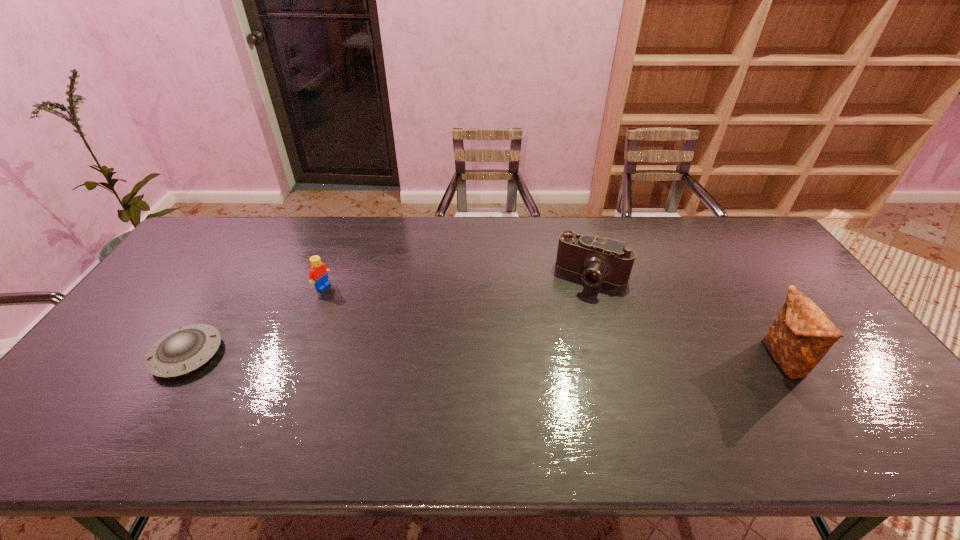
Locate an element on the screen. The width and height of the screenshot is (960, 540). free spot located 0.120m on the front-facing side of the second object from right to left is located at coordinates (568, 319).

The width and height of the screenshot is (960, 540). I want to click on vacant area located on the front-facing side of the second object from right to left, so click(562, 333).

The width and height of the screenshot is (960, 540). Find the location of `free location located 0.390m on the front-facing side of the second object from right to left`. free location located 0.390m on the front-facing side of the second object from right to left is located at coordinates (533, 391).

Where is `blank space located on the face of the Lego`? blank space located on the face of the Lego is located at coordinates (394, 324).

Find the location of a particular element. vacant space located 0.190m on the face of the Lego is located at coordinates 374,314.

Find the location of a particular element. vacant space located on the face of the Lego is located at coordinates (424, 340).

This screenshot has width=960, height=540. I want to click on saucer that is at the near edge, so click(185, 349).

Locate an element on the screen. Image resolution: width=960 pixels, height=540 pixels. clutch bag located at the near edge is located at coordinates (802, 334).

At what (x,y) coordinates should I click in order to perform the action: click on object that is positioned at the left edge. Please return your answer as a coordinate pair (x, y). Image resolution: width=960 pixels, height=540 pixels. Looking at the image, I should click on (185, 349).

The image size is (960, 540). I want to click on object located in the near left corner section of the desktop, so click(x=185, y=349).